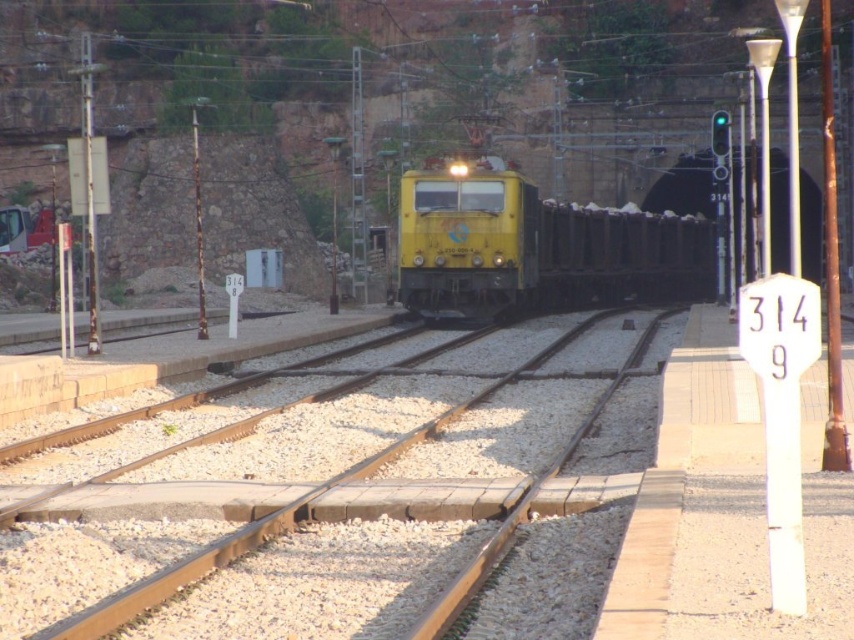
Is point (665, 296) in front of point (492, 330)?

No, (665, 296) is further to viewer.

You are a GUI agent. You are given a task and a screenshot of the screen. Output one action in this format:
    pyautogui.click(x=<x>, y=<y>)
    Task: Click on the yellow matte train at center
    This screenshot has height=640, width=854.
    Given the screenshot: What is the action you would take?
    pyautogui.click(x=535, y=246)

This screenshot has height=640, width=854. What are the coordinates of `yellow matte train at center` in the screenshot? It's located at (535, 246).